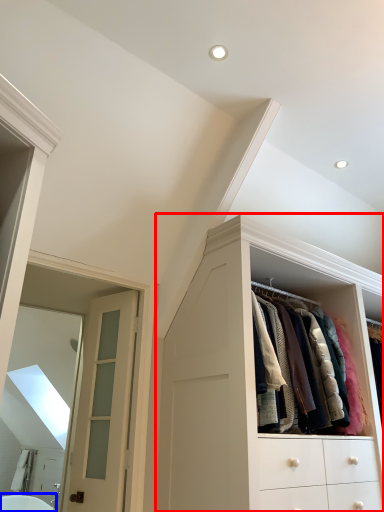
Question: Which object is further to the camera taking this photo, cabinetry (highlighted by a red box) or bath (highlighted by a blue box)?

Choices:
 (A) cabinetry
 (B) bath

Answer: (B)